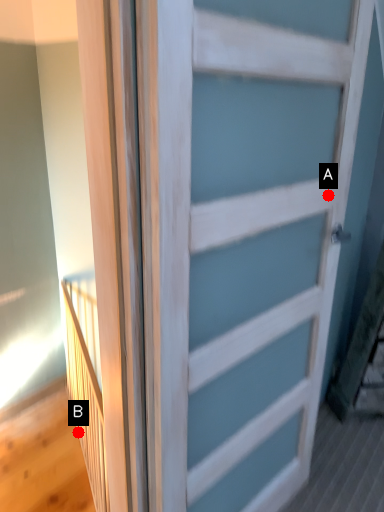
Question: Two points are circled on the image, labeled by A and B beside each circle. Which of the following is the farthest from the observer?

Choices:
 (A) A is further
 (B) B is further

Answer: (B)